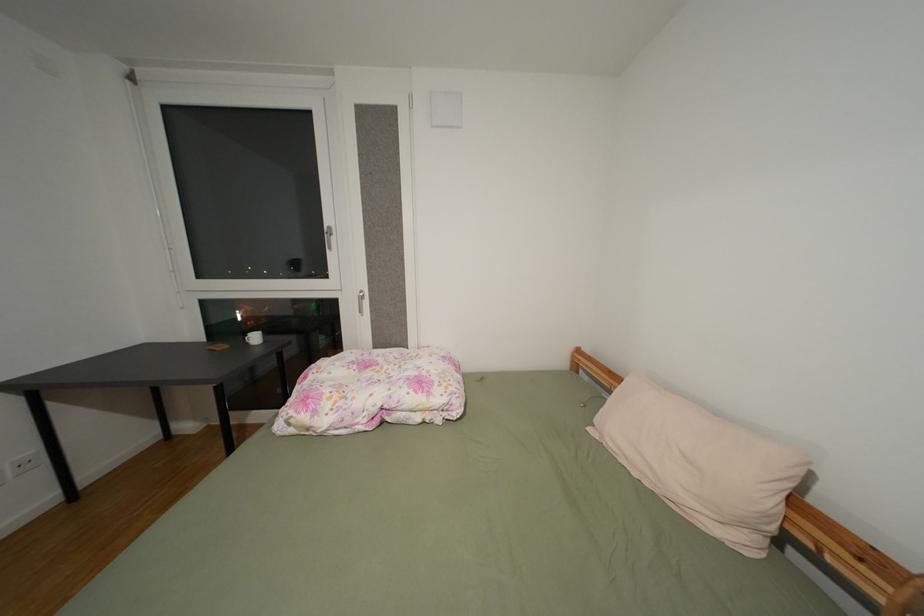
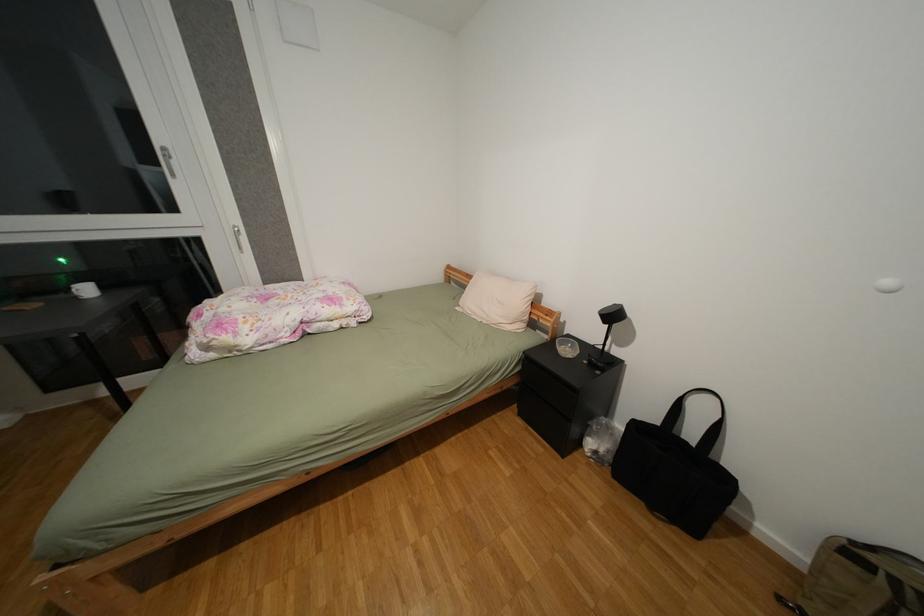
Question: The first image is from the beginning of the video and the second image is from the end. How did the camera likely rotate when shooting the video?

Choices:
 (A) Left
 (B) Right
 (C) Up
 (D) Down

Answer: (B)